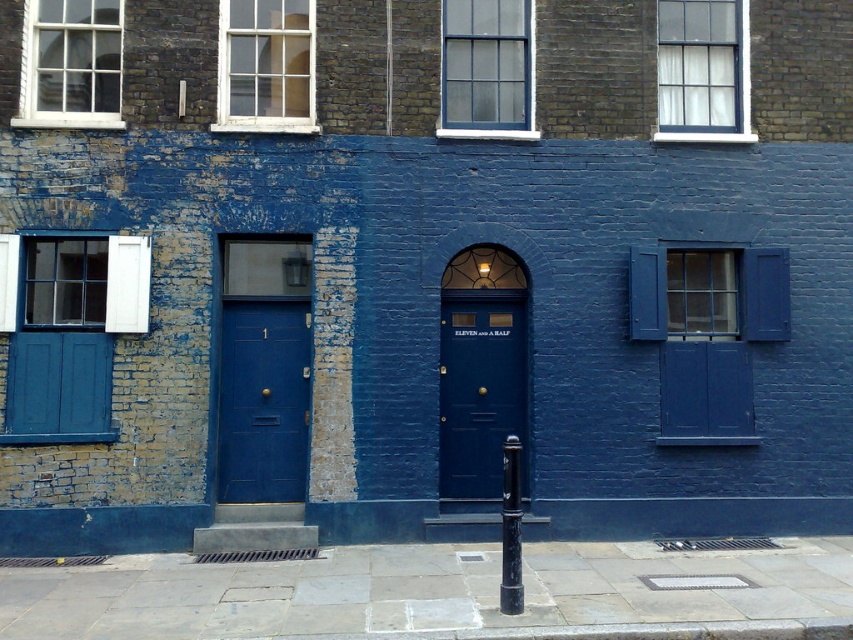
You are standing in front of the building and want to locate the matte blue window at right. According to the coordinates provided, where would you look relative to the doorways?

The matte blue window at right is located at coordinates point (706, 333), which is to the right side of the building near the upper part of the structure.

You are a delivery person standing at the camera position. You need to deliver a package to the matte blue window at right. Can you reach it without moving from your current position?

The matte blue window at right and camera are 32.79 feet apart, so you cannot reach the matte blue window at right without moving from your current position because the distance is too far.